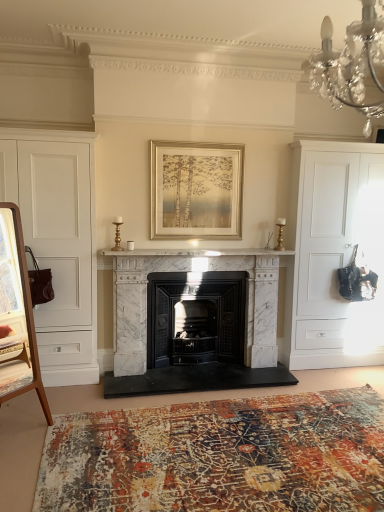
Question: Considering the relative sizes of white matte cabinet at right, which is counted as the 1th cabinetry, starting from the right, and gold metallic picture frame at center in the image provided, is white matte cabinet at right, which is counted as the 1th cabinetry, starting from the right, bigger than gold metallic picture frame at center?

Choices:
 (A) yes
 (B) no

Answer: (A)

Question: Does white matte cabinet at right, the second cabinetry when ordered from left to right, appear on the right side of gold metallic picture frame at center?

Choices:
 (A) no
 (B) yes

Answer: (B)

Question: Can you confirm if white matte cabinet at right, the second cabinetry when ordered from left to right, is positioned to the left of gold metallic picture frame at center?

Choices:
 (A) no
 (B) yes

Answer: (A)

Question: Is white matte cabinet at right, the second cabinetry when ordered from left to right, wider than gold metallic picture frame at center?

Choices:
 (A) no
 (B) yes

Answer: (B)

Question: Can you confirm if white matte cabinet at right, which is counted as the 1th cabinetry, starting from the right, is shorter than gold metallic picture frame at center?

Choices:
 (A) no
 (B) yes

Answer: (A)

Question: Is textured rug at lower center situated inside white marble fireplace at center or outside?

Choices:
 (A) inside
 (B) outside

Answer: (B)

Question: Considering their positions, is textured rug at lower center located in front of or behind white marble fireplace at center?

Choices:
 (A) front
 (B) behind

Answer: (A)

Question: Does point (276, 421) appear closer or farther from the camera than point (163, 248)?

Choices:
 (A) closer
 (B) farther

Answer: (A)

Question: From a real-world perspective, is textured rug at lower center positioned above or below white marble fireplace at center?

Choices:
 (A) below
 (B) above

Answer: (A)

Question: In the image, is gold metallic picture frame at center positioned in front of or behind white matte cabinet at right, the second cabinetry when ordered from left to right?

Choices:
 (A) behind
 (B) front

Answer: (B)

Question: In terms of height, does gold metallic picture frame at center look taller or shorter compared to white matte cabinet at right, the second cabinetry when ordered from left to right?

Choices:
 (A) tall
 (B) short

Answer: (B)

Question: Is point (183, 238) positioned closer to the camera than point (367, 312)?

Choices:
 (A) closer
 (B) farther

Answer: (A)

Question: Considering the positions of gold metallic picture frame at center and white matte cabinet at right, the second cabinetry when ordered from left to right, in the image, is gold metallic picture frame at center wider or thinner than white matte cabinet at right, the second cabinetry when ordered from left to right,?

Choices:
 (A) thin
 (B) wide

Answer: (A)

Question: From the image's perspective, is white marble fireplace at center, which ranks as the 1th fireplace in right-to-left order, located above or below textured rug at lower center?

Choices:
 (A) above
 (B) below

Answer: (A)

Question: From their relative heights in the image, would you say white marble fireplace at center, which ranks as the 1th fireplace in right-to-left order, is taller or shorter than textured rug at lower center?

Choices:
 (A) tall
 (B) short

Answer: (A)